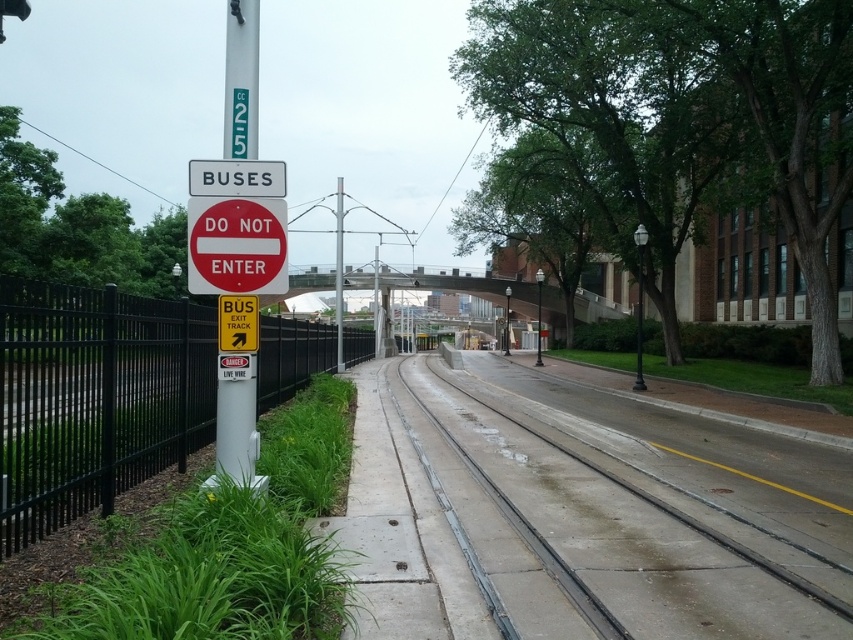
Question: Which of the following is the farthest from the observer?

Choices:
 (A) black metal fence at left
 (B) white plastic sign at upper center

Answer: (B)

Question: Where is smooth concrete track at center located in relation to black metal fence at left in the image?

Choices:
 (A) left
 (B) right

Answer: (B)

Question: Which point is closer to the camera?

Choices:
 (A) smooth concrete track at center
 (B) metallic pole at center

Answer: (A)

Question: Which point is closer to the camera taking this photo?

Choices:
 (A) (192, 248)
 (B) (341, 237)
 (C) (248, 387)

Answer: (A)

Question: Is white plastic sign at upper center to the right of metallic pole at center from the viewer's perspective?

Choices:
 (A) yes
 (B) no

Answer: (B)

Question: Can you confirm if red matte do not enter sign at upper left is positioned to the left of white plastic sign at upper center?

Choices:
 (A) yes
 (B) no

Answer: (B)